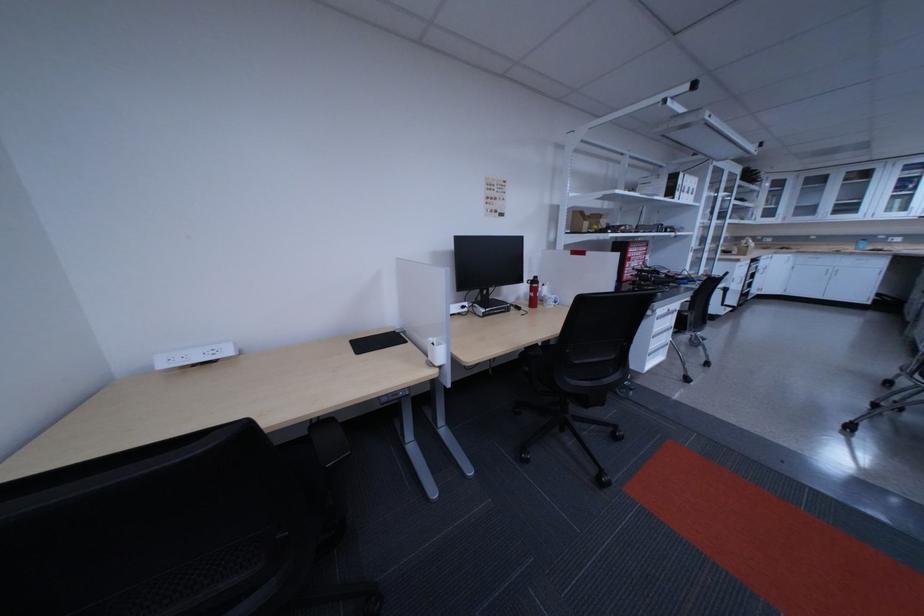
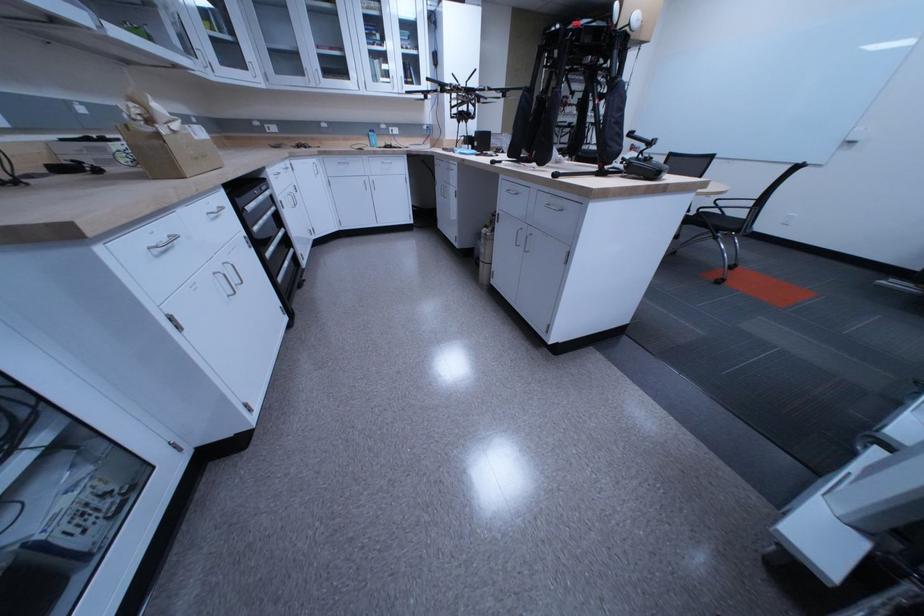
In the second image, find the point that corresponds to (858,246) in the first image.

(373, 140)